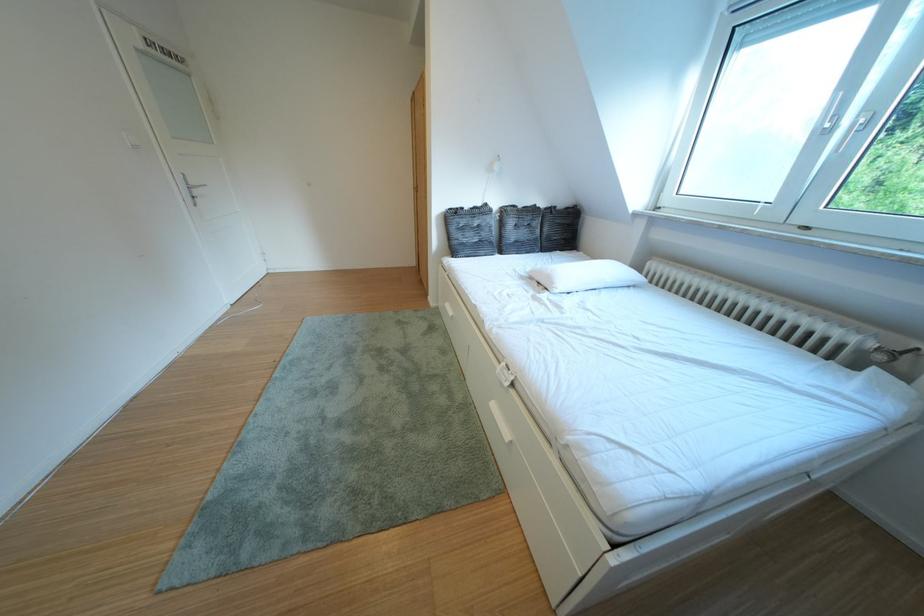
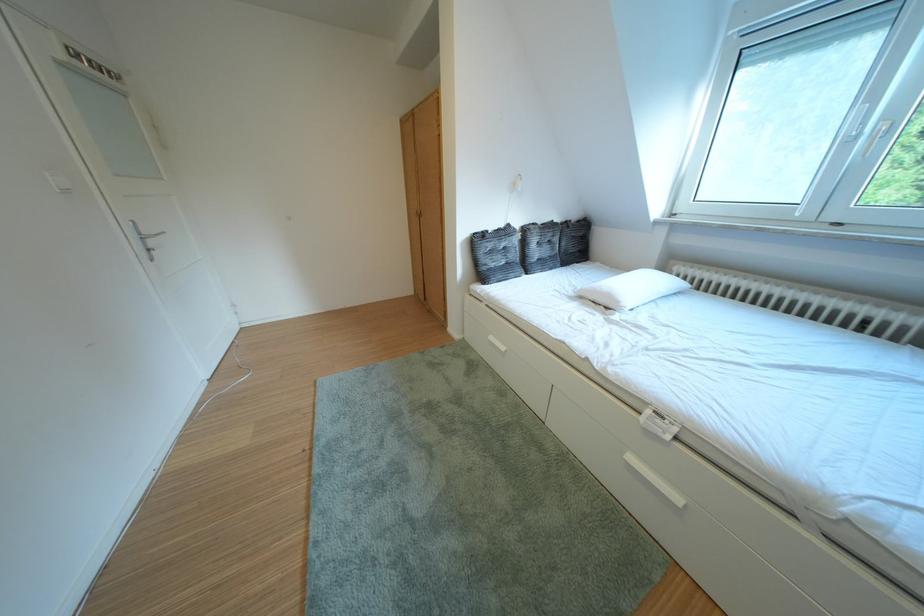
Question: The camera is either moving clockwise (left) or counter-clockwise (right) around the object. The first image is from the beginning of the video and the second image is from the end. Is the camera moving left or right when shooting the video?

Choices:
 (A) Left
 (B) Right

Answer: (A)